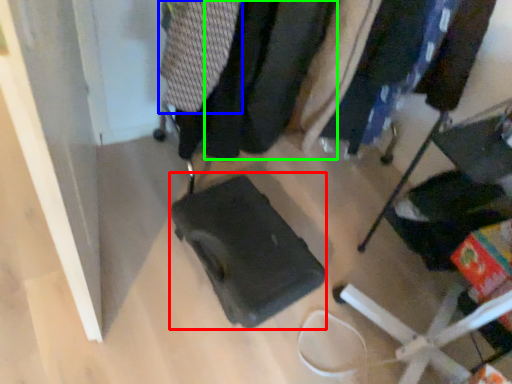
Question: Which object is positioned closest to luggage (highlighted by a red box)? Select from clothing (highlighted by a blue box) and clothing (highlighted by a green box).

Choices:
 (A) clothing
 (B) clothing

Answer: (B)